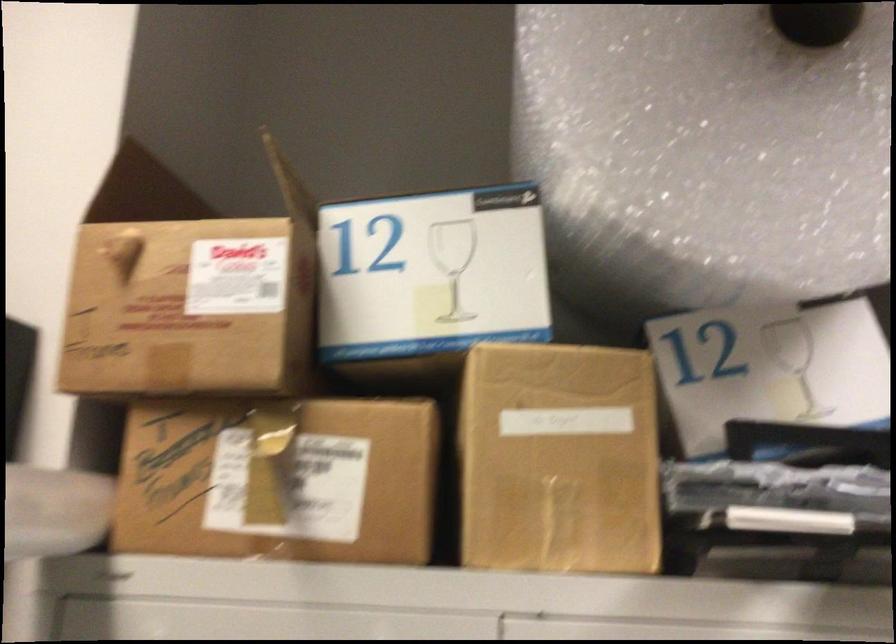
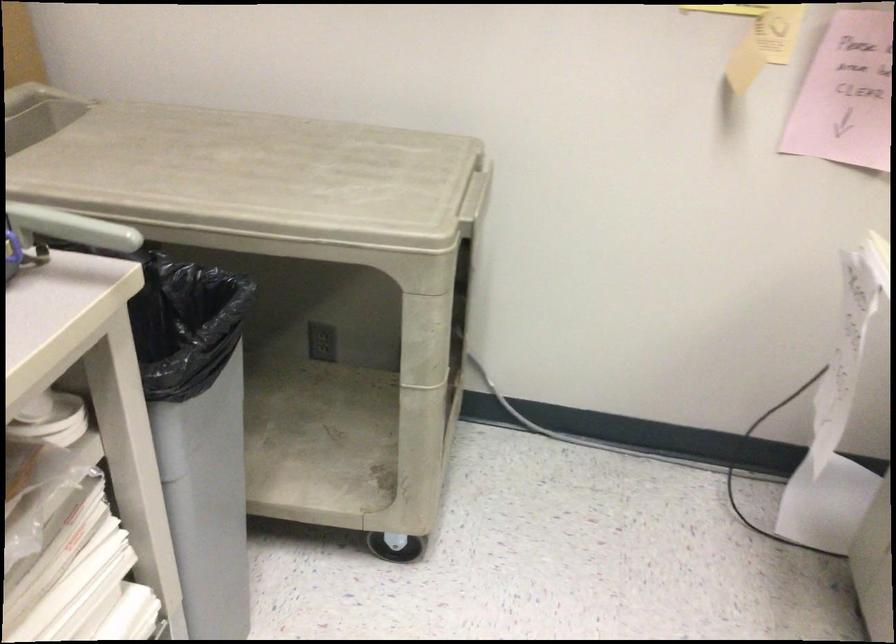
The images are taken continuously from a first-person perspective. In which direction is your viewpoint rotating?

The camera rotated toward right-down.